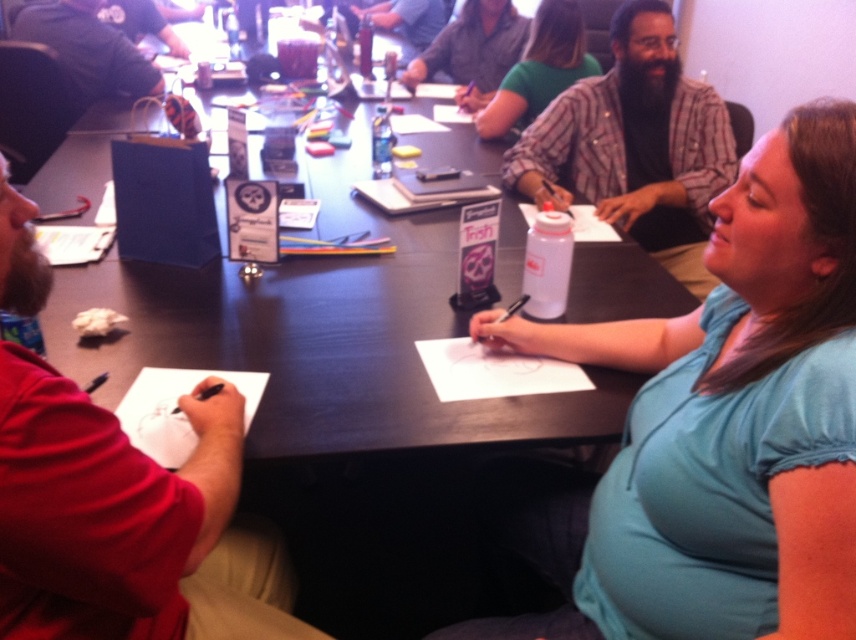
Does blue cotton shirt at center have a greater width compared to black glossy table at center?

No.

Find the location of `blue cotton shirt at center`. blue cotton shirt at center is located at coordinates (720, 426).

Locate an element on the screen. The image size is (856, 640). blue cotton shirt at center is located at coordinates (720, 426).

Can you confirm if black glossy table at center is bigger than red shirt at left?

Yes, black glossy table at center is bigger than red shirt at left.

Find the location of a particular element. This screenshot has width=856, height=640. black glossy table at center is located at coordinates (324, 333).

Between point (394, 422) and point (147, 632), which one is positioned in front?

Point (147, 632) is more forward.

What are the coordinates of `black glossy table at center` in the screenshot? It's located at (324, 333).

Does blue cotton shirt at center have a greater width compared to green shirt at upper center?

No, blue cotton shirt at center is not wider than green shirt at upper center.

Does blue cotton shirt at center appear on the left side of green shirt at upper center?

No, blue cotton shirt at center is not to the left of green shirt at upper center.

Which is behind, point (616, 518) or point (492, 51)?

The point (492, 51) is more distant.

What are the coordinates of `blue cotton shirt at center` in the screenshot? It's located at (720, 426).